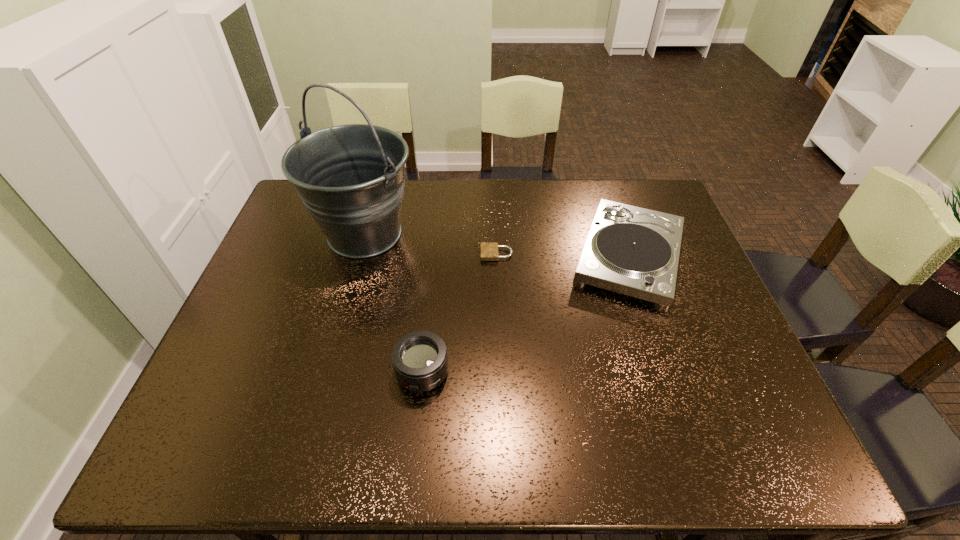
At what (x,y) coordinates should I click in order to perform the action: click on object that stands as the closest to the rightmost object. Please return your answer as a coordinate pair (x, y). Looking at the image, I should click on (489, 250).

Find the location of `vacant position in the image that satisfies the following two spatial constraints: 1. on the keyhole side of the padlock; 2. on the side of the nearest object with brand markings and control switches`. vacant position in the image that satisfies the following two spatial constraints: 1. on the keyhole side of the padlock; 2. on the side of the nearest object with brand markings and control switches is located at coordinates (501, 373).

At what (x,y) coordinates should I click in order to perform the action: click on vacant position in the image that satisfies the following two spatial constraints: 1. on the back side of the rightmost object; 2. on the keyhole side of the padlock. Please return your answer as a coordinate pair (x, y). Looking at the image, I should click on (628, 254).

Image resolution: width=960 pixels, height=540 pixels. I want to click on vacant space that satisfies the following two spatial constraints: 1. on the keyhole side of the second object from right to left; 2. on the side of the nearest object with brand markings and control switches, so click(501, 373).

Locate an element on the screen. The image size is (960, 540). vacant space that satisfies the following two spatial constraints: 1. on the keyhole side of the rightmost object; 2. on the left side of the shortest object is located at coordinates (496, 257).

Identify the location of free space that satisfies the following two spatial constraints: 1. on the back side of the record player; 2. on the keyhole side of the shortest object. (628, 254).

Locate an element on the screen. This screenshot has height=540, width=960. free space that satisfies the following two spatial constraints: 1. on the keyhole side of the padlock; 2. on the side of the telephoto lens with brand markings and control switches is located at coordinates (501, 373).